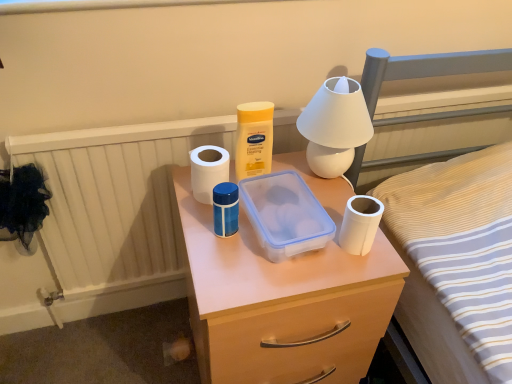
Find the location of a particular element. vacant area that is in front of yellow plastic container at center is located at coordinates (234, 255).